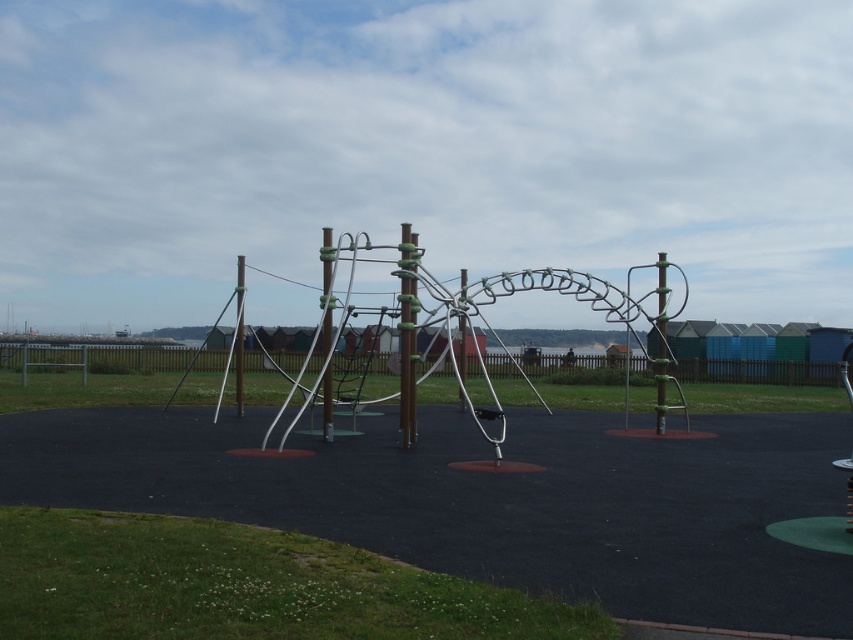
Question: Which object is the farthest from the metallic silver pole at right?

Choices:
 (A) green plastic pole at center
 (B) green rubber pole at center
 (C) metallic silver playground equipment at center
 (D) green matte pole at center

Answer: (A)

Question: Can you confirm if metallic silver playground equipment at center is positioned to the left of green plastic pole at center?

Choices:
 (A) yes
 (B) no

Answer: (B)

Question: Is metallic silver playground equipment at center behind green matte pole at center?

Choices:
 (A) no
 (B) yes

Answer: (A)

Question: Among these points, which one is farthest from the camera?

Choices:
 (A) pos(325,301)
 (B) pos(409,339)
 (C) pos(236,364)

Answer: (C)

Question: Which of the following is the closest to the observer?

Choices:
 (A) green plastic pole at center
 (B) metallic silver pole at right
 (C) green matte pole at center

Answer: (C)

Question: Does metallic silver playground equipment at center have a lesser width compared to green matte pole at center?

Choices:
 (A) yes
 (B) no

Answer: (B)